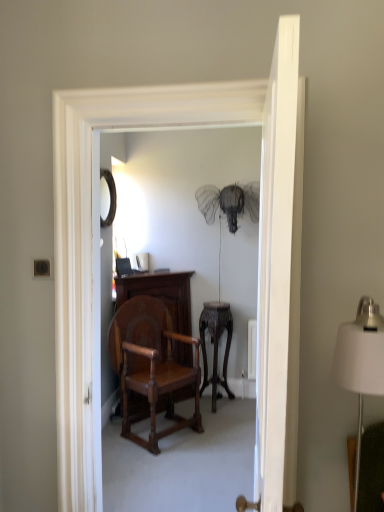
At what (x,y) coordinates should I click in order to perform the action: click on matte black mirror at upper left. Please return your answer as a coordinate pair (x, y). This screenshot has width=384, height=512. Looking at the image, I should click on (110, 197).

The height and width of the screenshot is (512, 384). What do you see at coordinates (279, 275) in the screenshot? I see `white smooth door at center` at bounding box center [279, 275].

What do you see at coordinates (361, 361) in the screenshot? I see `white fabric lampshade at right` at bounding box center [361, 361].

Image resolution: width=384 pixels, height=512 pixels. Describe the element at coordinates (151, 368) in the screenshot. I see `polished wood chair at center` at that location.

This screenshot has width=384, height=512. I want to click on matte black mirror at upper left, so 110,197.

In the scene shown: How different are the orientations of white smooth door at center and polished wood vanity at center in degrees?

white smooth door at center and polished wood vanity at center are facing 135 degrees away from each other.

Is white smooth door at center far away from polished wood vanity at center?

That's right, there is a large distance between white smooth door at center and polished wood vanity at center.

From a real-world perspective, is white smooth door at center located higher than polished wood vanity at center?

Yes, from a real-world perspective, white smooth door at center is above polished wood vanity at center.

Does white smooth door at center have a larger size compared to polished wood vanity at center?

No, white smooth door at center is not bigger than polished wood vanity at center.

Image resolution: width=384 pixels, height=512 pixels. I want to click on table lamp on the right of dark wood side table at center, so click(x=361, y=361).

Choose the correct answer: Is white fabric lampshade at right inside dark wood side table at center or outside it?

white fabric lampshade at right is located beyond the bounds of dark wood side table at center.

Measure the distance from white fabric lampshade at right to dark wood side table at center.

white fabric lampshade at right is 8.27 feet away from dark wood side table at center.

Who is taller, white fabric lampshade at right or dark wood side table at center?

Standing taller between the two is dark wood side table at center.

Is dark wood side table at center at the back of white smooth door at center?

No, white smooth door at center's orientation is not away from dark wood side table at center.

Is white smooth door at center taller or shorter than dark wood side table at center?

white smooth door at center is taller than dark wood side table at center.

Consider the image. Considering the sizes of objects white smooth door at center and dark wood side table at center in the image provided, who is bigger, white smooth door at center or dark wood side table at center?

With larger size is white smooth door at center.

Consider the image. From a real-world perspective, which is physically below, white smooth door at center or dark wood side table at center?

From a 3D spatial view, dark wood side table at center is below.

Is matte black mirror at upper left in contact with white fabric lampshade at right?

No, matte black mirror at upper left is not beside white fabric lampshade at right.

Considering the sizes of objects matte black mirror at upper left and white fabric lampshade at right in the image provided, who is wider, matte black mirror at upper left or white fabric lampshade at right?

With larger width is white fabric lampshade at right.

Considering the relative sizes of matte black mirror at upper left and white fabric lampshade at right in the image provided, is matte black mirror at upper left shorter than white fabric lampshade at right?

Indeed, matte black mirror at upper left has a lesser height compared to white fabric lampshade at right.

Could you tell me if matte black mirror at upper left is turned towards dark wood side table at center?

No, matte black mirror at upper left does not turn towards dark wood side table at center.

Are matte black mirror at upper left and dark wood side table at center located far from each other?

Absolutely, matte black mirror at upper left is distant from dark wood side table at center.

From the image's perspective, between matte black mirror at upper left and dark wood side table at center, who is located below?

dark wood side table at center.

In the scene shown: Is matte black mirror at upper left taller than dark wood side table at center?

In fact, matte black mirror at upper left may be shorter than dark wood side table at center.

Between point (350, 369) and point (192, 385), which one is positioned behind?

The point (192, 385) is behind.

Considering the relative positions of white fabric lampshade at right and polished wood chair at center in the image provided, is white fabric lampshade at right to the right of polished wood chair at center from the viewer's perspective?

Indeed, white fabric lampshade at right is positioned on the right side of polished wood chair at center.

Is polished wood chair at center a part of white fabric lampshade at right?

No, polished wood chair at center is not surrounded by white fabric lampshade at right.

Which of these two, white fabric lampshade at right or polished wood chair at center, is wider?

polished wood chair at center is wider.

Would you say matte black mirror at upper left is inside or outside polished wood chair at center?

matte black mirror at upper left is not inside polished wood chair at center, it's outside.

In the scene shown: Does matte black mirror at upper left come behind polished wood chair at center?

That is True.

Considering the relative sizes of matte black mirror at upper left and polished wood chair at center in the image provided, is matte black mirror at upper left wider than polished wood chair at center?

No.

Are matte black mirror at upper left and polished wood chair at center making contact?

No, matte black mirror at upper left is not in contact with polished wood chair at center.

Find the location of `vanity that appears behind the white smooth door at center`. vanity that appears behind the white smooth door at center is located at coordinates (161, 294).

Locate an element on the screen. table lamp above the dark wood side table at center (from a real-world perspective) is located at coordinates (361, 361).

Considering their positions, is polished wood vanity at center positioned further to white fabric lampshade at right than white smooth door at center?

polished wood vanity at center is further to white fabric lampshade at right.

From the image, which object appears to be nearer to dark wood side table at center, matte black mirror at upper left or white smooth door at center?

The object closer to dark wood side table at center is matte black mirror at upper left.

From the image, which object appears to be nearer to dark wood side table at center, matte black mirror at upper left or white fabric lampshade at right?

matte black mirror at upper left.

Based on their spatial positions, is polished wood chair at center or dark wood side table at center further from matte black mirror at upper left?

dark wood side table at center lies further to matte black mirror at upper left than the other object.

Considering their positions, is white smooth door at center positioned further to polished wood vanity at center than polished wood chair at center?

white smooth door at center is positioned further to the anchor polished wood vanity at center.

Considering their positions, is polished wood chair at center positioned closer to polished wood vanity at center than matte black mirror at upper left?

Among the two, polished wood chair at center is located nearer to polished wood vanity at center.

When comparing their distances from polished wood chair at center, does white smooth door at center or polished wood vanity at center seem closer?

polished wood vanity at center is closer to polished wood chair at center.

When comparing their distances from matte black mirror at upper left, does white smooth door at center or dark wood side table at center seem further?

The object further to matte black mirror at upper left is white smooth door at center.

Identify the location of mirror between white smooth door at center and polished wood vanity at center along the z-axis. This screenshot has width=384, height=512. (110, 197).

I want to click on mirror between white fabric lampshade at right and polished wood vanity at center along the z-axis, so click(110, 197).

Identify the location of chair between matte black mirror at upper left and dark wood side table at center from top to bottom. This screenshot has height=512, width=384. (151, 368).

At what (x,y) coordinates should I click in order to perform the action: click on chair between white smooth door at center and polished wood vanity at center from front to back. Please return your answer as a coordinate pair (x, y). The width and height of the screenshot is (384, 512). Looking at the image, I should click on (151, 368).